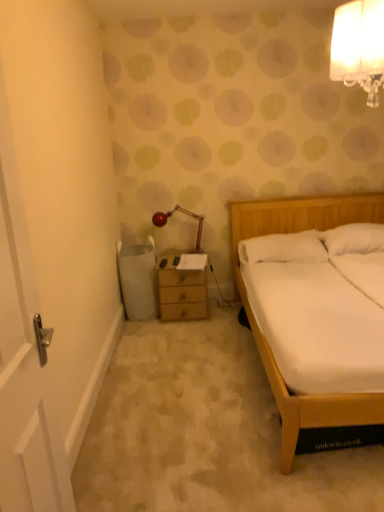
The width and height of the screenshot is (384, 512). In order to click on free space in front of white plastic trash bin at left in this screenshot , I will do `click(146, 333)`.